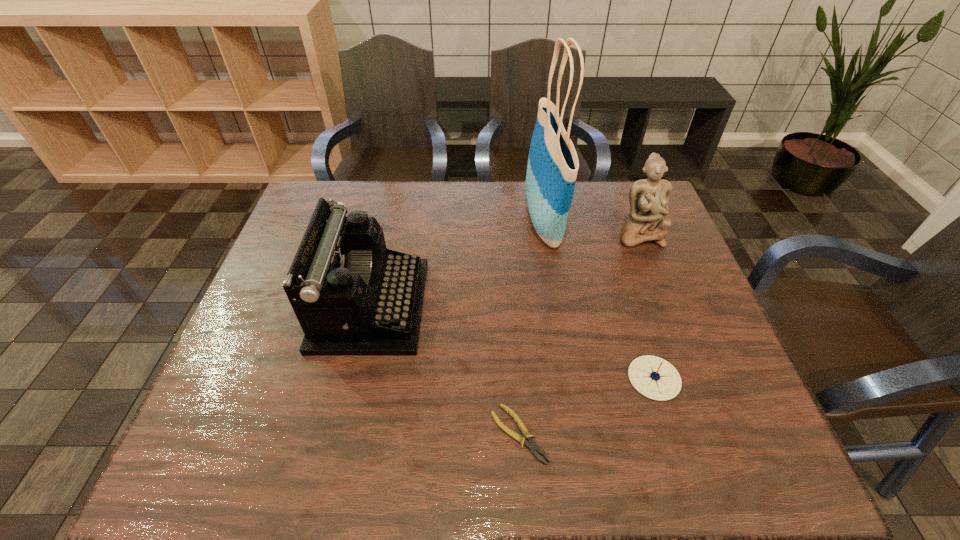
I want to click on the tallest object, so click(x=553, y=164).

The width and height of the screenshot is (960, 540). I want to click on tote bag, so click(x=553, y=164).

Where is `figurine`? This screenshot has width=960, height=540. figurine is located at coordinates (649, 198).

The width and height of the screenshot is (960, 540). I want to click on typewriter, so click(354, 296).

What are the coordinates of `the fourth tallest object` in the screenshot? It's located at (653, 377).

Identify the location of compass. (653, 377).

Where is `the nearest object`? This screenshot has height=540, width=960. the nearest object is located at coordinates (532, 445).

Where is `pliers`? This screenshot has width=960, height=540. pliers is located at coordinates (532, 445).

The image size is (960, 540). I want to click on free space located 0.380m on the front of the tote bag, so coord(569,386).

Find the location of a particular element. The image size is (960, 540). vacant space situated 0.360m on the front-facing side of the figurine is located at coordinates (684, 354).